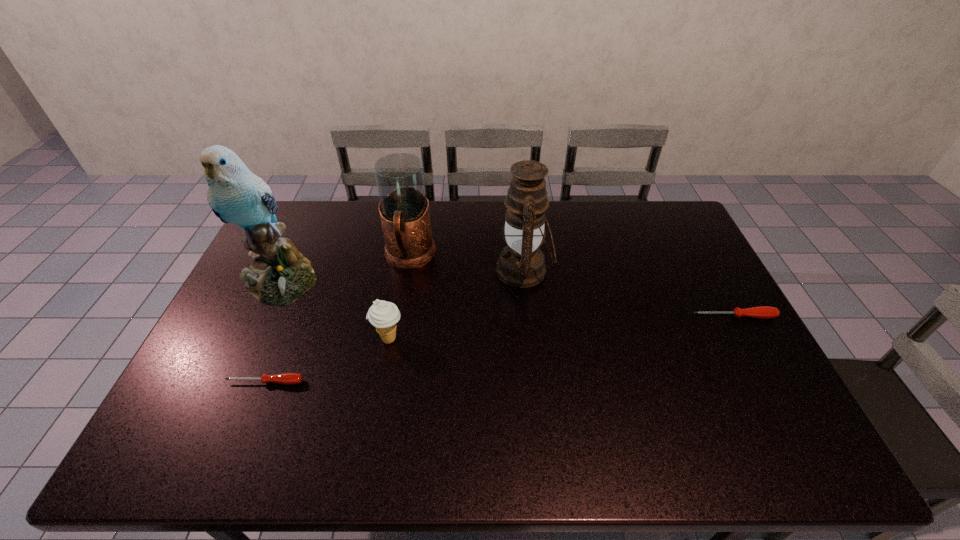
Please point a location where one more screwdriver can be added evenly. Please provide its 2D coordinates. Your answer should be formatted as a tuple, i.e. [(x, y)], where the tuple contains the x and y coordinates of a point satisfying the conditions above.

[(515, 347)]